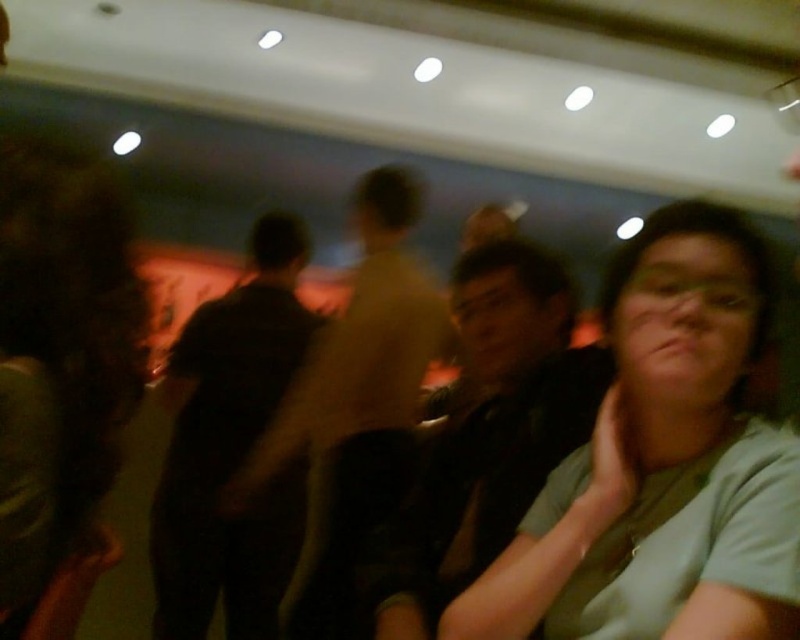
Question: Can you confirm if dark matte shirt at center is bigger than white matte hand at lower right?

Choices:
 (A) yes
 (B) no

Answer: (A)

Question: Does dark brown shirt at center appear on the right side of white matte hand at lower right?

Choices:
 (A) yes
 (B) no

Answer: (B)

Question: Estimate the real-world distances between objects in this image. Which object is closer to the white matte hand at lower right?

Choices:
 (A) dark brown shirt at center
 (B) matte black shirt at center

Answer: (B)

Question: Considering the real-world distances, which object is farthest from the light blue fabric at center?

Choices:
 (A) dark brown shirt at center
 (B) dark matte shirt at center
 (C) matte black shirt at center
 (D) white matte hand at lower right

Answer: (B)

Question: Which object appears closest to the camera in this image?

Choices:
 (A) light blue fabric at center
 (B) white matte hand at lower right

Answer: (A)

Question: Is matte black shirt at center positioned in front of dark brown shirt at center?

Choices:
 (A) yes
 (B) no

Answer: (A)